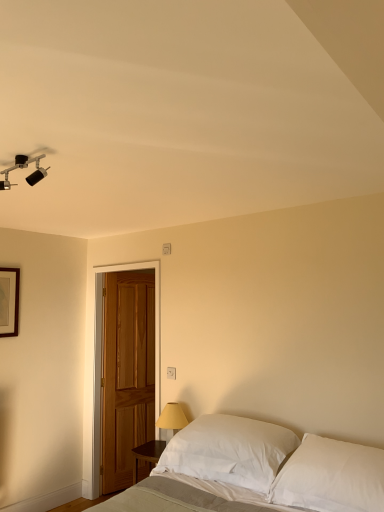
Question: Relative to matte black track light at upper left, is wooden picture frame at upper left in front or behind?

Choices:
 (A) front
 (B) behind

Answer: (B)

Question: Does point 11,294 appear closer or farther from the camera than point 6,181?

Choices:
 (A) farther
 (B) closer

Answer: (A)

Question: Considering the real-world distances, which object is farthest from the white soft bed at lower center?

Choices:
 (A) yellow fabric lampshade at lower center
 (B) matte black track light at upper left
 (C) wooden door at left
 (D) white cotton pillow at lower right, which ranks as the first pillow in right-to-left order
 (E) wooden picture frame at upper left

Answer: (E)

Question: Which is nearer to the wooden door at left?

Choices:
 (A) white soft bed at lower center
 (B) white cotton pillow at lower right, placed as the 2th pillow when sorted from left to right
 (C) matte black track light at upper left
 (D) yellow fabric lampshade at lower center
 (E) white plastic electric outlet at center

Answer: (D)